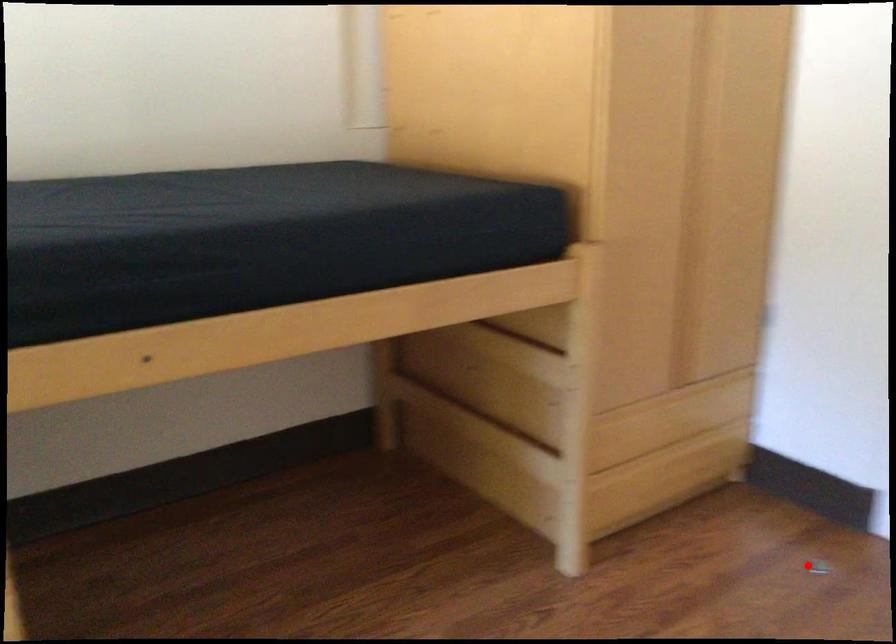
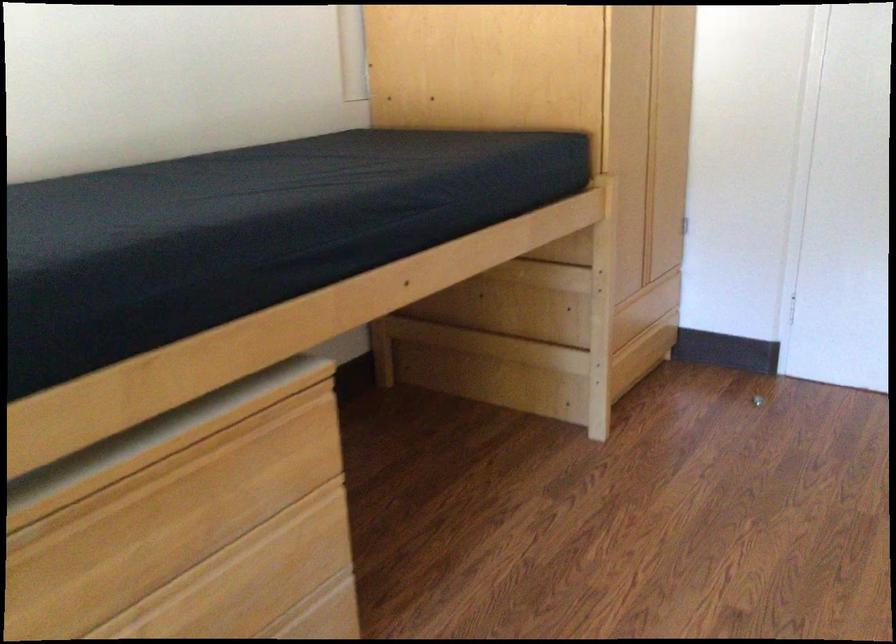
Find the pixel in the second image that matches the highlighted location in the first image.

(757, 400)